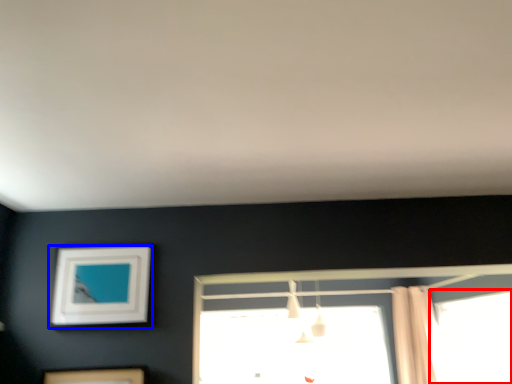
Question: Which point is closer to the camera, window (highlighted by a red box) or picture frame (highlighted by a blue box)?

Choices:
 (A) window
 (B) picture frame

Answer: (B)